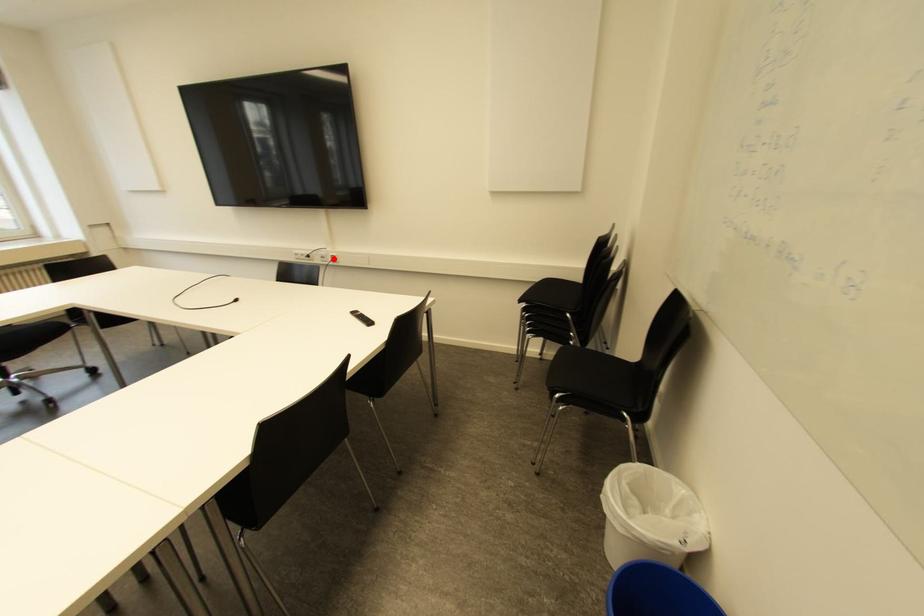
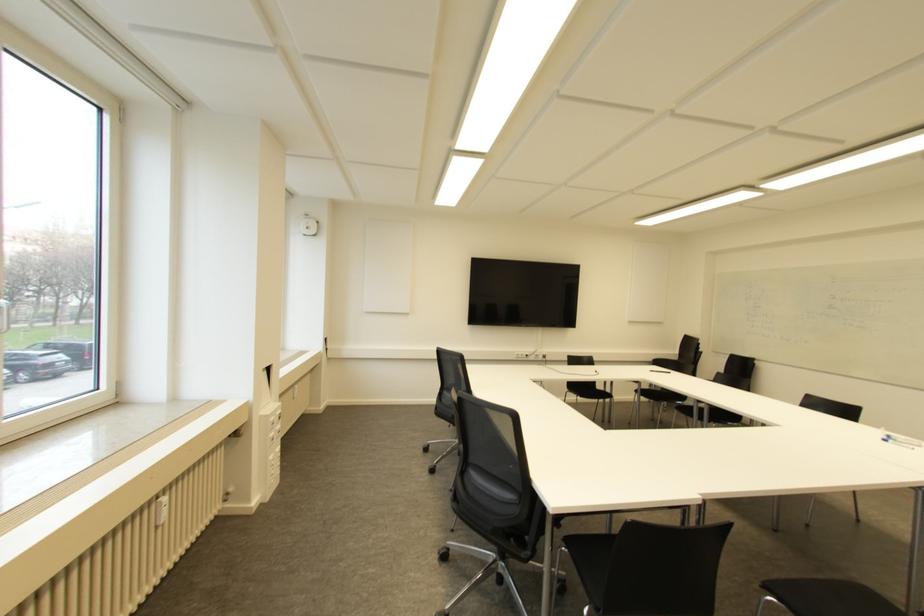
Locate, in the second image, the point that corresponds to the highlighted location in the first image.

(543, 355)